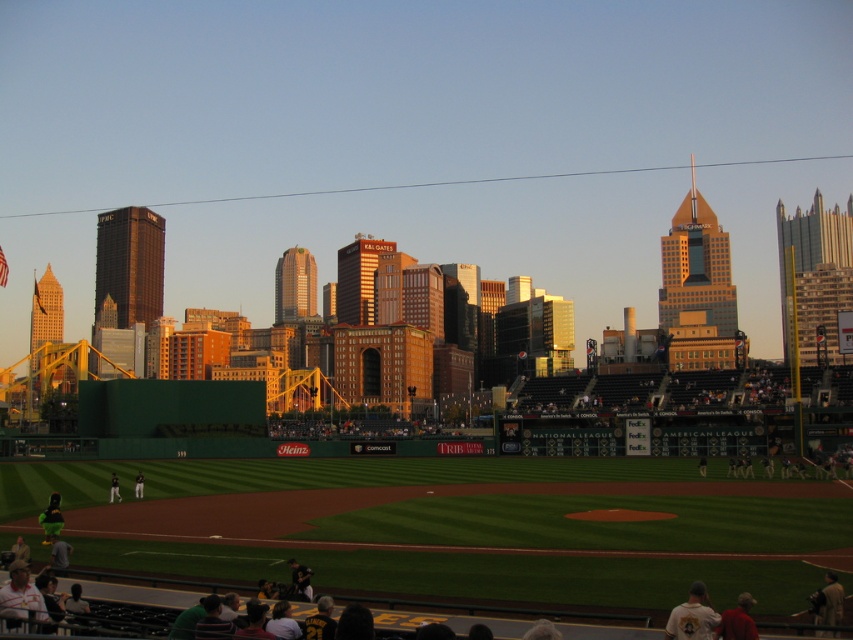
You are a photographer standing at the edge of the baseball field. You notice two fans in the stands wearing different colored shirts. The white jersey at lower right and the dark blue shirt at lower center. Which fan is sitting higher up in the stadium seats?

The white jersey at lower right is located above the dark blue shirt at lower center, meaning the fan wearing the white jersey at lower right is sitting higher up in the stadium seats.

You are a photographer standing at the edge of the baseball field. You want to take a photo that includes both the red fabric shirt at lower right and the dark gray uniform at center. Which of these two items should you focus on first to ensure both are in sharp focus?

The red fabric shirt at lower right is closer to the viewer than the dark gray uniform at center. To ensure both are in sharp focus, you should focus on the dark gray uniform at center because it is farther away, allowing the closer object to also be in focus within the depth of field.

You are a photographer trying to capture a photo of the mascot on the pitcher mound. You have two flags to place in the scene for the photo shoot. One is a red fabric shirt at lower right and the other is a dark gray uniform at center. The photographer wants to ensure that the shorter flag is placed closer to the mascot to avoid blocking the view. Which flag should be placed closer to the mascot?

The red fabric shirt at lower right is shorter than the dark gray uniform at center, so the photographer should place the red fabric shirt at lower right closer to the mascot to avoid blocking the view.